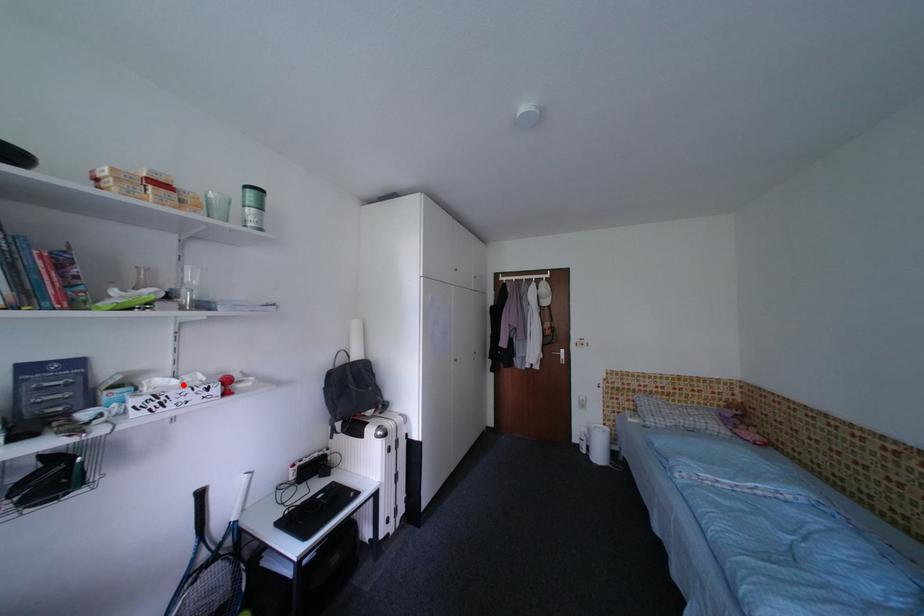
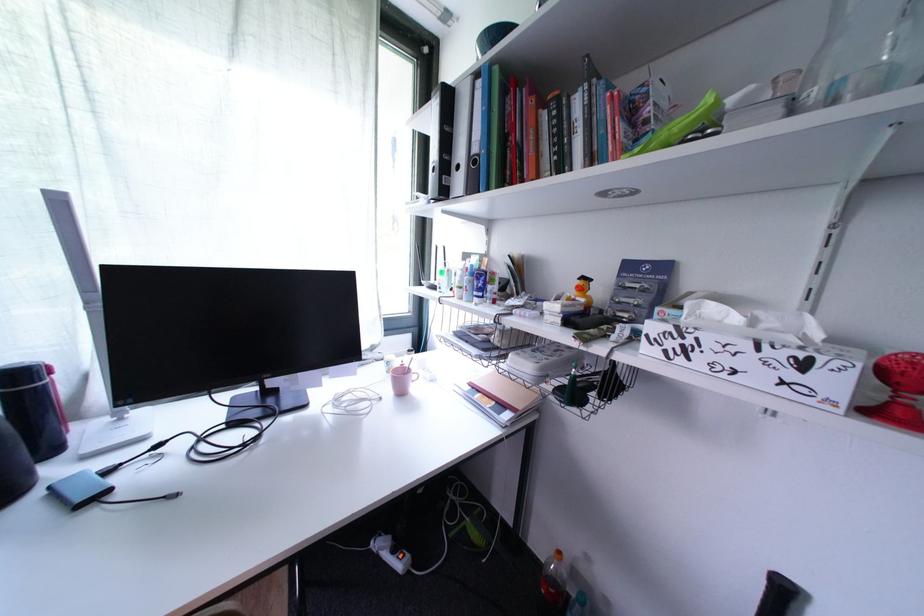
Where in the second image is the point corresponding to the highlighted location from the first image?

(745, 321)